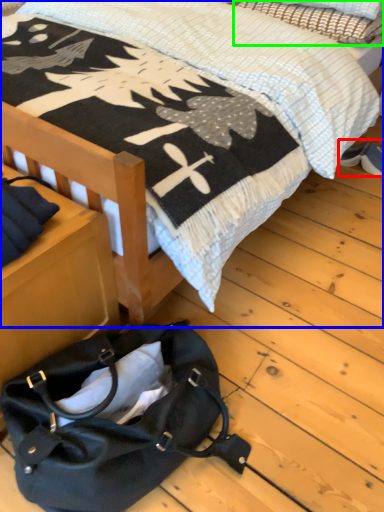
Question: Which object is positioned farthest from footwear (highlighted by a red box)? Select from bed (highlighted by a blue box) and pillow (highlighted by a green box).

Choices:
 (A) bed
 (B) pillow

Answer: (A)